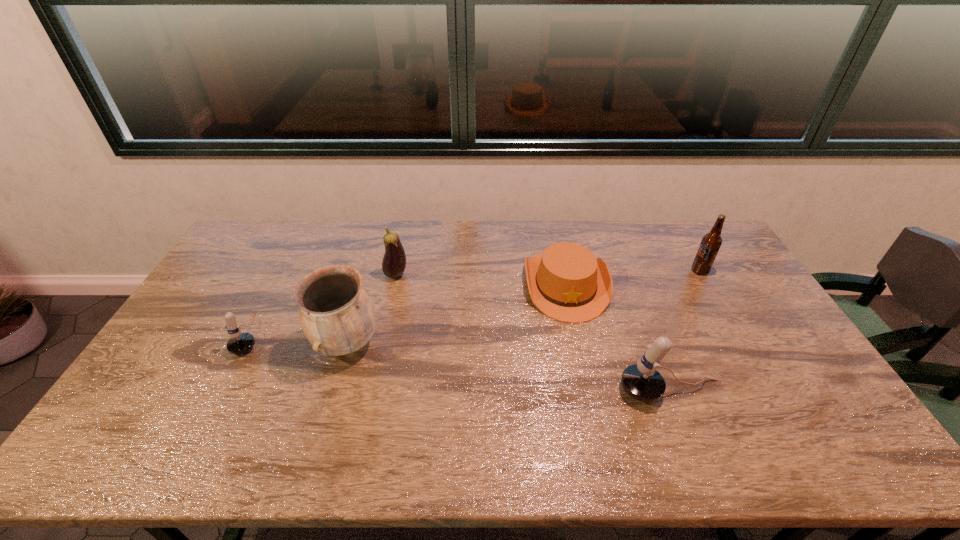
Where is `free spot located 0.270m on the label of the rightmost object`? Image resolution: width=960 pixels, height=540 pixels. free spot located 0.270m on the label of the rightmost object is located at coordinates (613, 271).

The height and width of the screenshot is (540, 960). Identify the location of free space located on the label of the rightmost object. (594, 271).

Locate an element on the screen. free spot located 0.100m on the label of the rightmost object is located at coordinates (662, 271).

The width and height of the screenshot is (960, 540). Identify the location of free location located on the front-facing side of the cowboy hat. (581, 352).

Locate an element on the screen. free region located on the front of the eggplant is located at coordinates (391, 297).

Image resolution: width=960 pixels, height=540 pixels. Find the location of `vacant region located 0.100m on the front of the urn`. vacant region located 0.100m on the front of the urn is located at coordinates (328, 406).

The width and height of the screenshot is (960, 540). I want to click on object located at the far edge, so click(566, 282).

You are a GUI agent. You are given a task and a screenshot of the screen. Output one action in this format:
    pyautogui.click(x=<x>, y=<y>)
    Task: Click on the object at the near edge
    Image resolution: width=960 pixels, height=540 pixels.
    Given the screenshot: What is the action you would take?
    pyautogui.click(x=641, y=381)

Identify the location of object located in the right edge section of the desktop. (711, 242).

In the image, there is a desktop. Identify the location of vacant space at the far edge. (576, 242).